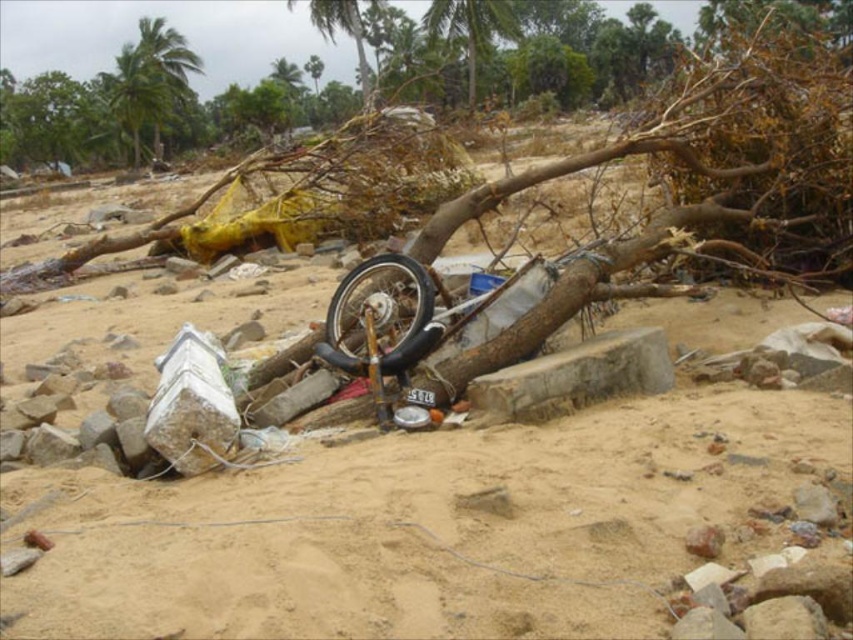
Between black rubber wheel at center and green leafy palm tree at upper left, which one is positioned higher?

Positioned higher is green leafy palm tree at upper left.

Can you confirm if black rubber wheel at center is positioned to the left of green leafy palm tree at upper left?

In fact, black rubber wheel at center is to the right of green leafy palm tree at upper left.

Who is more distant from viewer, (350, 317) or (155, 97)?

Positioned behind is point (155, 97).

Find the location of a particular element. black rubber wheel at center is located at coordinates (379, 310).

Which of these two, black rubber wheel at center or green leafy palm tree at upper center, stands taller?

green leafy palm tree at upper center

Is black rubber wheel at center thinner than green leafy palm tree at upper center?

Indeed, black rubber wheel at center has a lesser width compared to green leafy palm tree at upper center.

I want to click on black rubber wheel at center, so click(x=379, y=310).

Can you confirm if green leafy palm tree at upper left is taller than green leafy palm tree at upper center?

Indeed, green leafy palm tree at upper left has a greater height compared to green leafy palm tree at upper center.

Is green leafy palm tree at upper left to the left of green leafy palm tree at upper center from the viewer's perspective?

Correct, you'll find green leafy palm tree at upper left to the left of green leafy palm tree at upper center.

In order to click on green leafy palm tree at upper left in this screenshot , I will do `click(135, 92)`.

You are a GUI agent. You are given a task and a screenshot of the screen. Output one action in this format:
    pyautogui.click(x=<x>, y=<y>)
    Task: Click on the green leafy palm tree at upper left
    The height and width of the screenshot is (640, 853).
    Given the screenshot: What is the action you would take?
    pyautogui.click(x=135, y=92)